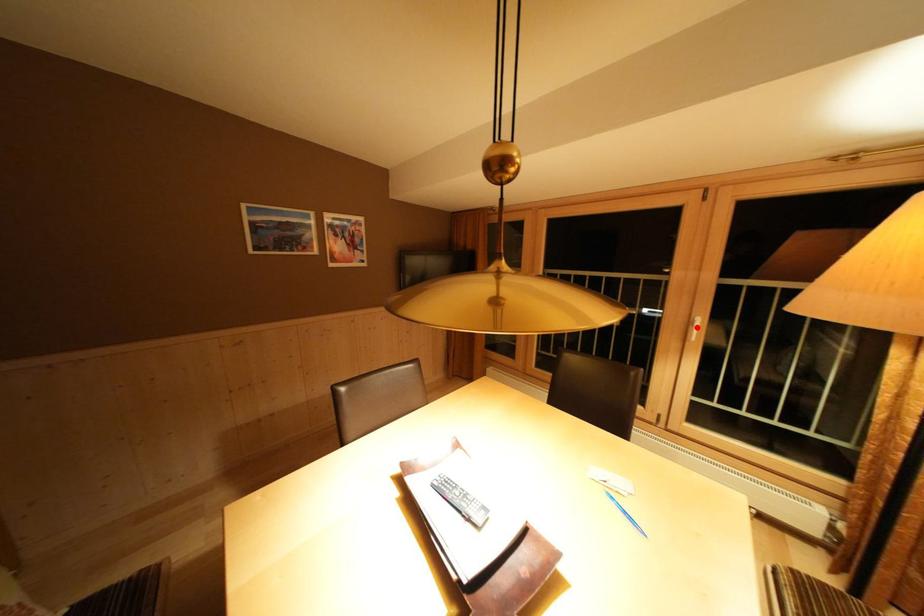
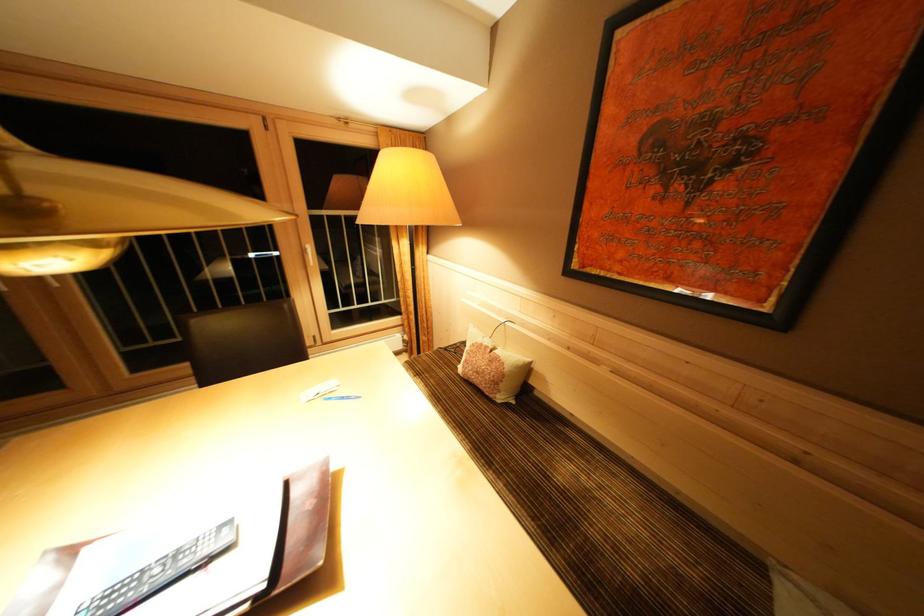
Question: I am providing you with two images of the same scene from different viewpoints. A red point is shown in image1. For the corresponding object point in image2, is it positioned nearer or farther from the camera?

Choices:
 (A) Nearer
 (B) Farther

Answer: (A)